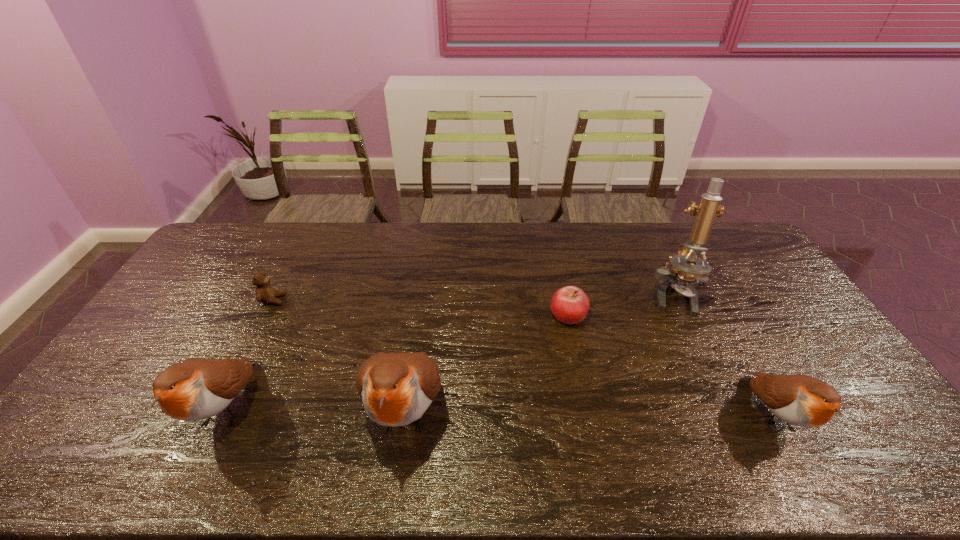
I want to click on free space for an extra bird to achieve even spacing, so click(588, 413).